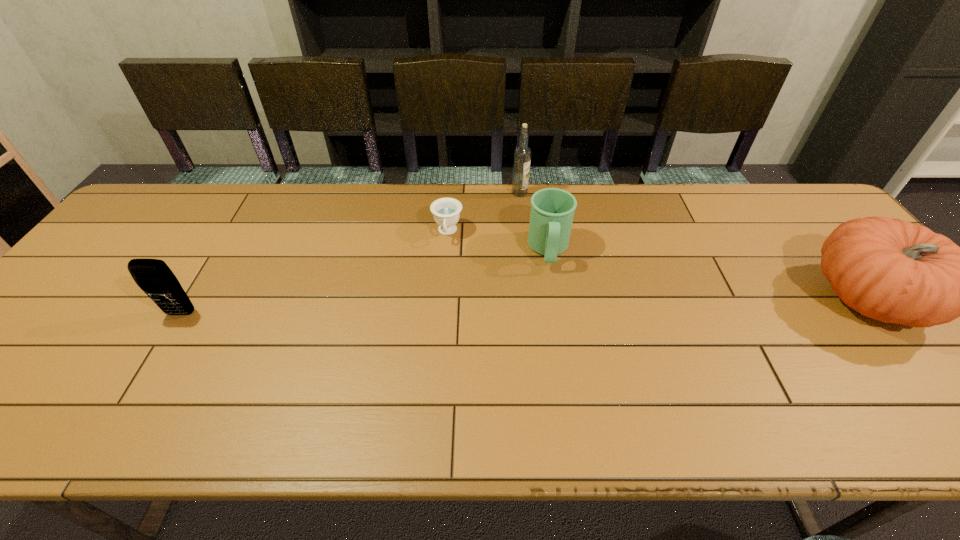
Where is `free space located on the side of the mug with the handle`? This screenshot has width=960, height=540. free space located on the side of the mug with the handle is located at coordinates (554, 336).

At what (x,y) coordinates should I click in order to perform the action: click on free spot located 0.210m on the side of the mug with the handle. Please return your answer as a coordinate pair (x, y). The height and width of the screenshot is (540, 960). Looking at the image, I should click on (554, 336).

You are a GUI agent. You are given a task and a screenshot of the screen. Output one action in this format:
    pyautogui.click(x=<x>, y=<y>)
    Task: Click on the vacant position located 0.340m on the side of the mug with the handle
    The height and width of the screenshot is (540, 960).
    Given the screenshot: What is the action you would take?
    pyautogui.click(x=556, y=385)

Find the location of a particular element. vacant area located 0.360m on the side of the fourth object from right to left with the handle is located at coordinates (434, 351).

Identify the location of vacant space located 0.290m on the side of the fourth object from right to left with the handle. (437, 327).

The image size is (960, 540). What are the coordinates of `vacant space situated on the side of the fourth object from right to left with the handle` in the screenshot? It's located at (442, 284).

Locate an element on the screen. This screenshot has height=540, width=960. vodka present at the far edge is located at coordinates (522, 155).

Identify the location of mug present at the far edge. (552, 210).

This screenshot has width=960, height=540. In order to click on teacup present at the far edge in this screenshot , I will do `click(446, 211)`.

This screenshot has height=540, width=960. In the image, there is a desktop. Identify the location of vacant space at the far edge. click(x=230, y=225).